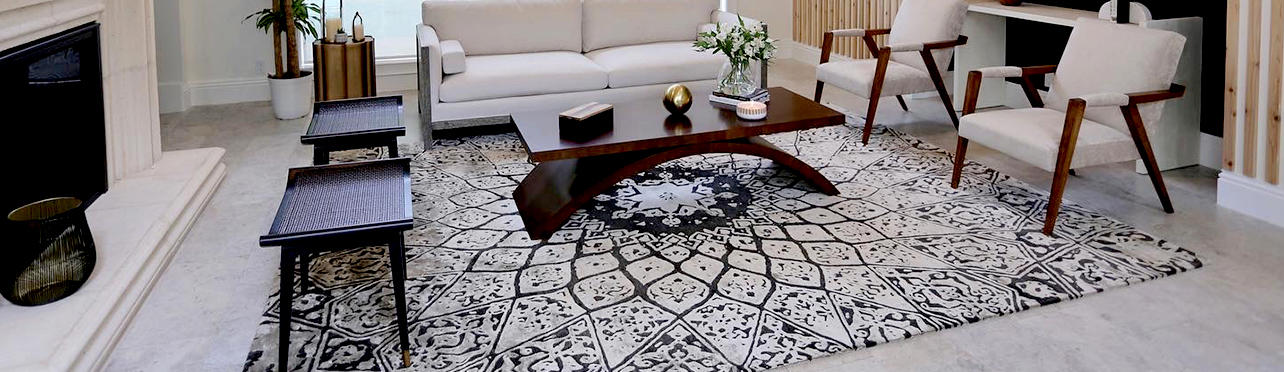
Image resolution: width=1284 pixels, height=372 pixels. I want to click on plant, so click(293, 20), click(738, 48).